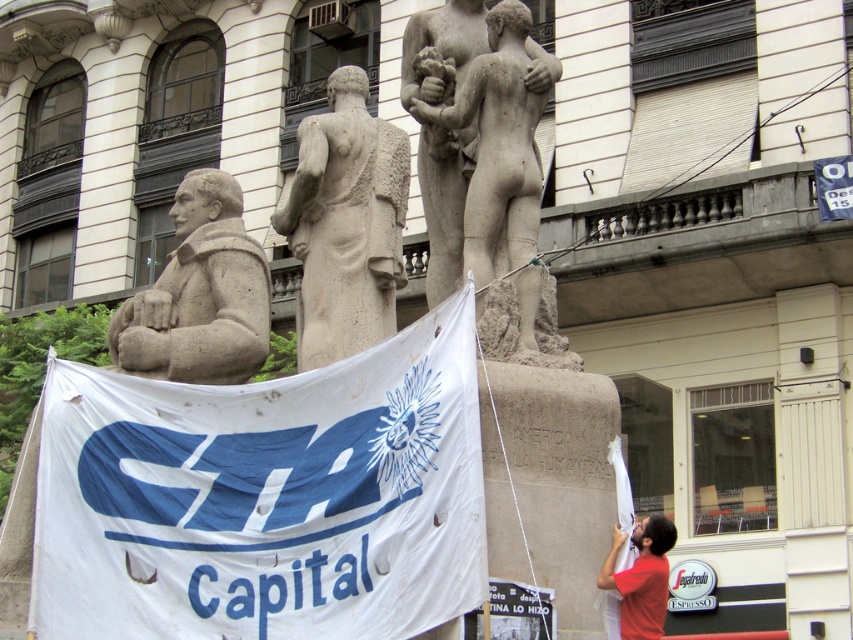
You are standing in front of the sculpture and want to take a photo of both the stone statue at center and the stone statue at left. Which statue should you position to your left side in the camera frame to include both in the photo?

You should position the stone statue at left to your left side in the camera frame because the stone statue at center is to the right of the stone statue at left, so arranging them this way will ensure both are captured in the photo.

You are a photographer standing in front of the sculpture. You want to take a photo that includes both the stone statue at center and the stone statue at left. Based on their heights, which statue should you focus on to ensure both are fully visible in the frame?

The stone statue at center is much taller than the stone statue at left, so focusing on the stone statue at center will ensure both are fully visible in the frame.